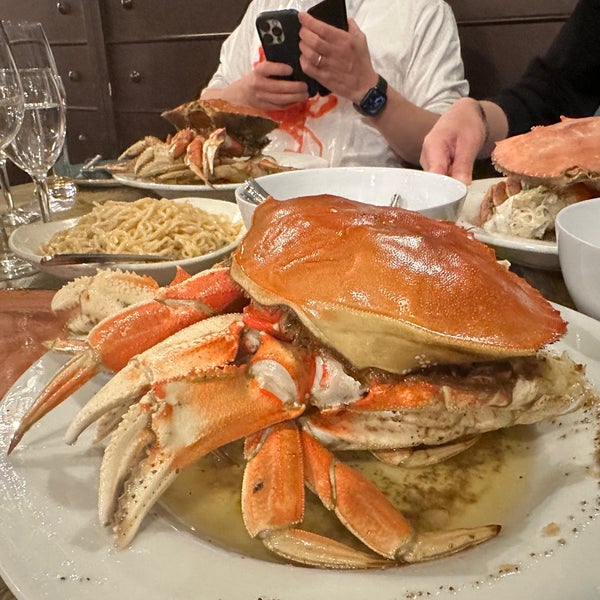
At what (x,y) coordinates should I click in order to perform the action: click on white bowl. Please return your answer as a coordinate pair (x, y). The image size is (600, 600). Looking at the image, I should click on (183, 265).